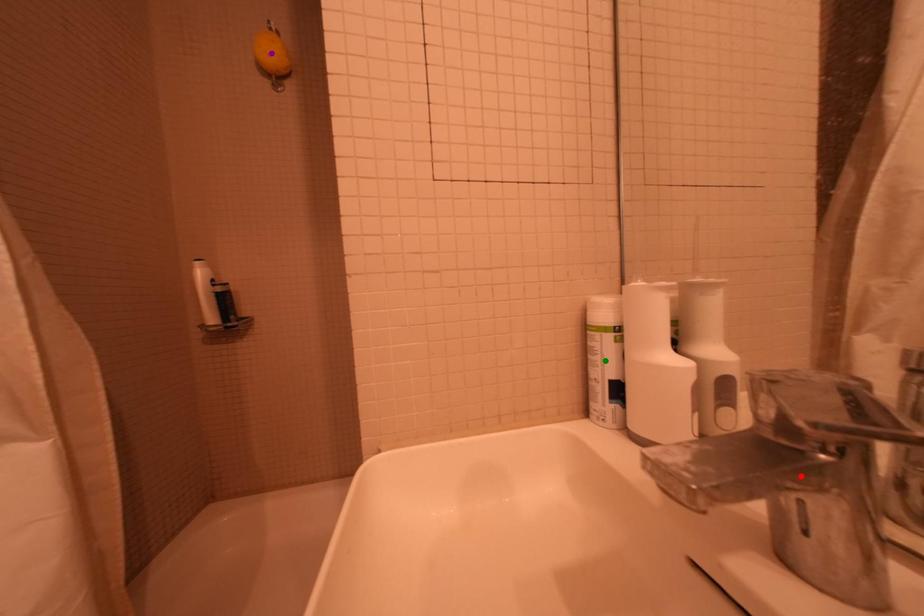
Order these from nearest to farthest:
A) purple point
B) green point
C) red point

red point < green point < purple point